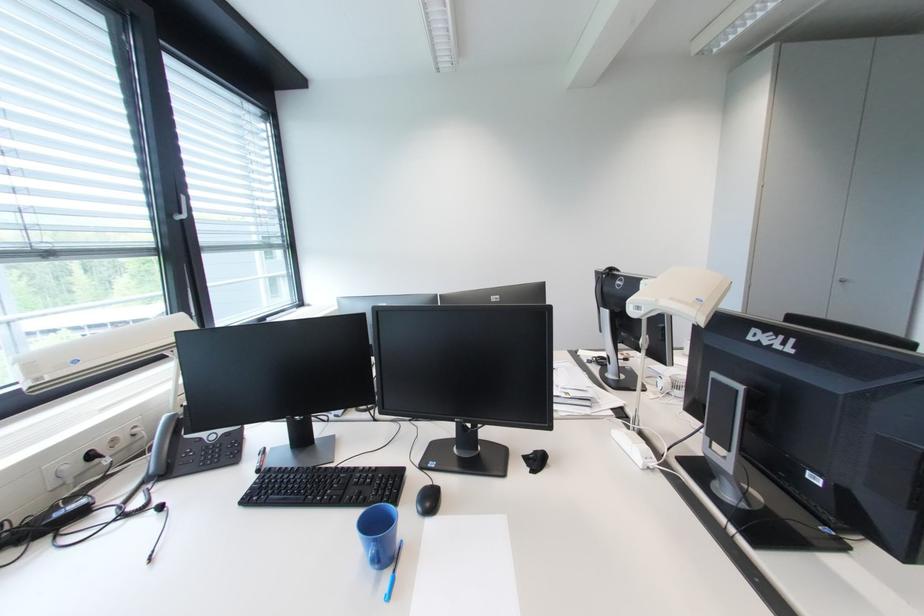
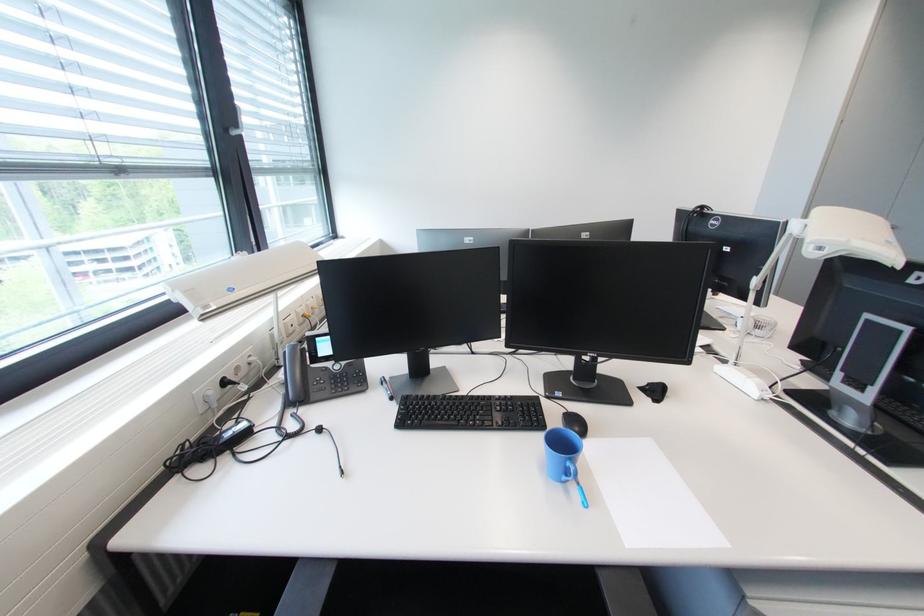
Locate, in the second image, the point that corresponds to pixel 394 577 in the first image.

(579, 488)